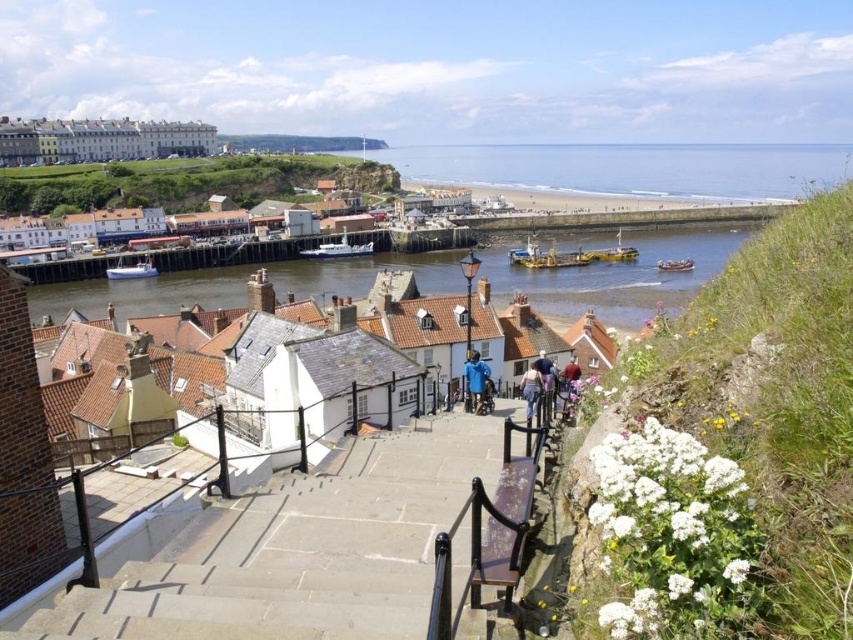
Question: Based on their relative distances, which object is farther from the smooth stone stairs at center?

Choices:
 (A) white plastic boat at lower left
 (B) wooden boat at center

Answer: (B)

Question: Which point is farther to the camera?

Choices:
 (A) blue fabric jacket at center
 (B) light brown leather jacket at center
 (C) metallic yellow boat at center

Answer: (C)

Question: Which object is closer to the camera taking this photo?

Choices:
 (A) light brown leather jacket at center
 (B) white flowered bush at right
 (C) brown water at center

Answer: (B)

Question: Can you confirm if white flowered bush at right is bigger than brown water at center?

Choices:
 (A) yes
 (B) no

Answer: (B)

Question: Does white matte boat at center have a lesser width compared to light brown leather jacket at center?

Choices:
 (A) yes
 (B) no

Answer: (B)

Question: Is white flowered bush at right below wooden boat at center?

Choices:
 (A) no
 (B) yes

Answer: (B)